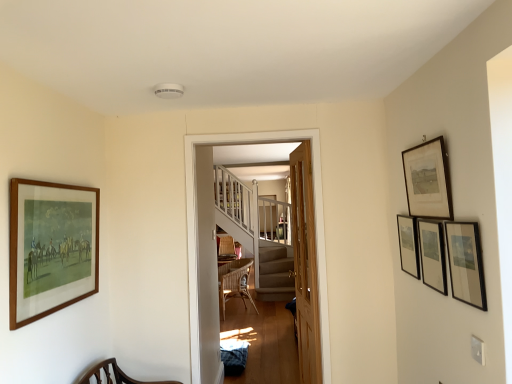
Question: Is black matte picture frame at upper right, the 3th picture frame viewed from the left, closer to the viewer compared to wooden staircase at center?

Choices:
 (A) no
 (B) yes

Answer: (B)

Question: Is black matte picture frame at upper right, acting as the 3th picture frame starting from the right, positioned with its back to wooden staircase at center?

Choices:
 (A) yes
 (B) no

Answer: (B)

Question: From a real-world perspective, is black matte picture frame at upper right, the 3th picture frame viewed from the left, physically below wooden staircase at center?

Choices:
 (A) yes
 (B) no

Answer: (B)

Question: Considering the relative sizes of black matte picture frame at upper right, acting as the 3th picture frame starting from the right, and wooden staircase at center in the image provided, is black matte picture frame at upper right, acting as the 3th picture frame starting from the right, thinner than wooden staircase at center?

Choices:
 (A) no
 (B) yes

Answer: (B)

Question: Are black matte picture frame at upper right, the 3th picture frame viewed from the left, and wooden staircase at center making contact?

Choices:
 (A) yes
 (B) no

Answer: (B)

Question: Can you confirm if black matte picture frame at upper right, the 3th picture frame viewed from the left, is positioned to the left of wooden staircase at center?

Choices:
 (A) yes
 (B) no

Answer: (B)

Question: From a real-world perspective, is wooden staircase at center below wooden framed print at upper right, the 4th picture frame viewed from the right?

Choices:
 (A) no
 (B) yes

Answer: (B)

Question: Could you tell me if wooden staircase at center is facing wooden framed print at upper right, positioned as the 2th picture frame in left-to-right order?

Choices:
 (A) no
 (B) yes

Answer: (A)

Question: Would you say wooden framed print at upper right, positioned as the 2th picture frame in left-to-right order, is part of wooden staircase at center's contents?

Choices:
 (A) yes
 (B) no

Answer: (B)

Question: Does wooden staircase at center have a lesser width compared to wooden framed print at upper right, positioned as the 2th picture frame in left-to-right order?

Choices:
 (A) no
 (B) yes

Answer: (A)

Question: From a real-world perspective, is wooden staircase at center on top of wooden framed print at upper right, the 4th picture frame viewed from the right?

Choices:
 (A) no
 (B) yes

Answer: (A)

Question: Can you confirm if wooden staircase at center is positioned to the right of wooden framed print at upper right, positioned as the 2th picture frame in left-to-right order?

Choices:
 (A) no
 (B) yes

Answer: (A)

Question: From a real-world perspective, is matte black picture frame at right, which is the second picture frame from right to left, beneath black matte picture frame at upper right, acting as the 3th picture frame starting from the right?

Choices:
 (A) yes
 (B) no

Answer: (B)